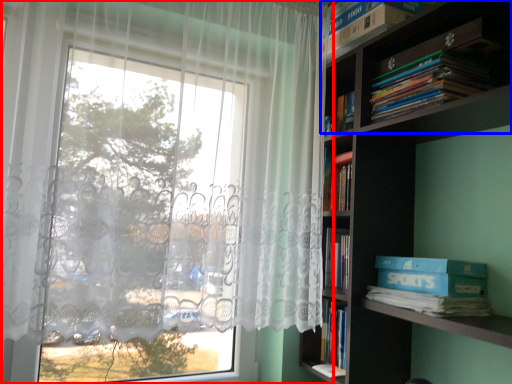
Question: Among these objects, which one is farthest to the camera, curtain (highlighted by a red box) or shelf (highlighted by a blue box)?

Choices:
 (A) curtain
 (B) shelf

Answer: (B)